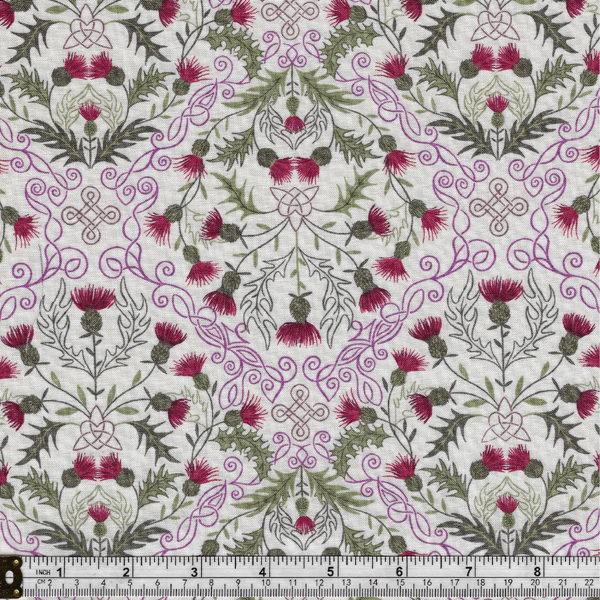
At what (x,y) coordinates should I click in order to perform the action: click on cloth. Please return your answer as a coordinate pair (x, y). The width and height of the screenshot is (600, 600). Looking at the image, I should click on (280, 279).